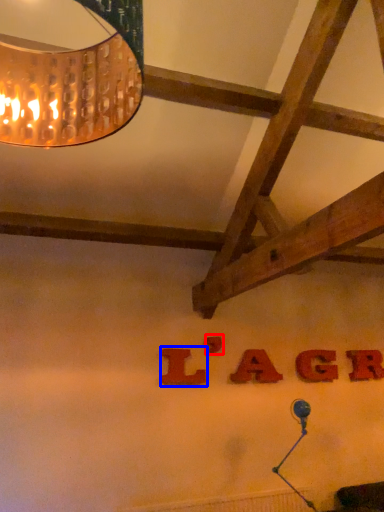
Question: Which object is further to the camera taking this photo, letter (highlighted by a red box) or letter (highlighted by a blue box)?

Choices:
 (A) letter
 (B) letter

Answer: (A)